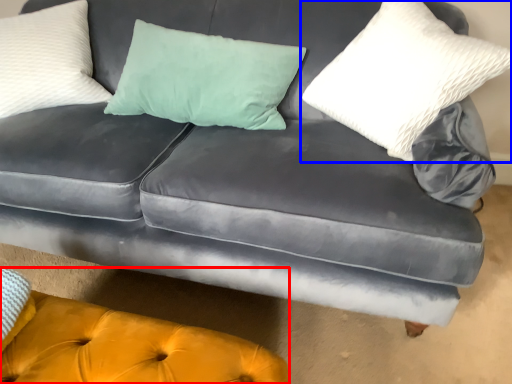
Question: Which of the following is the closest to the observer, couch (highlighted by a red box) or pillow (highlighted by a blue box)?

Choices:
 (A) couch
 (B) pillow

Answer: (A)